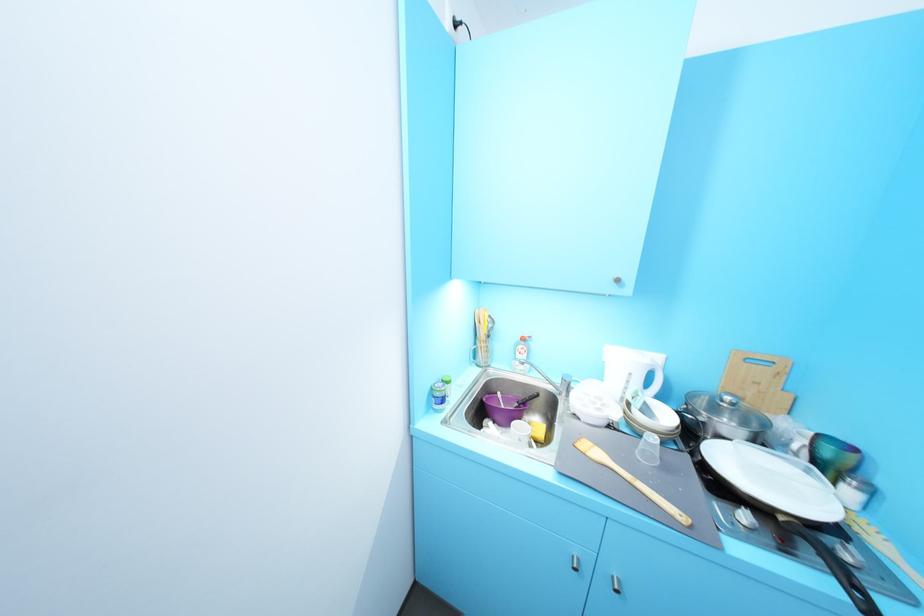
The location [630,480] corresponds to which object?

It refers to a wooden spatula.